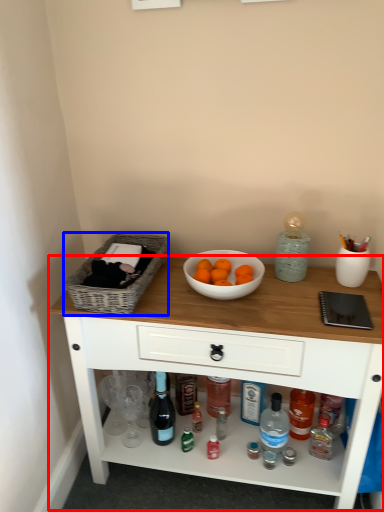
Question: Which object is closer to the camera taking this photo, table (highlighted by a red box) or basket (highlighted by a blue box)?

Choices:
 (A) table
 (B) basket

Answer: (A)